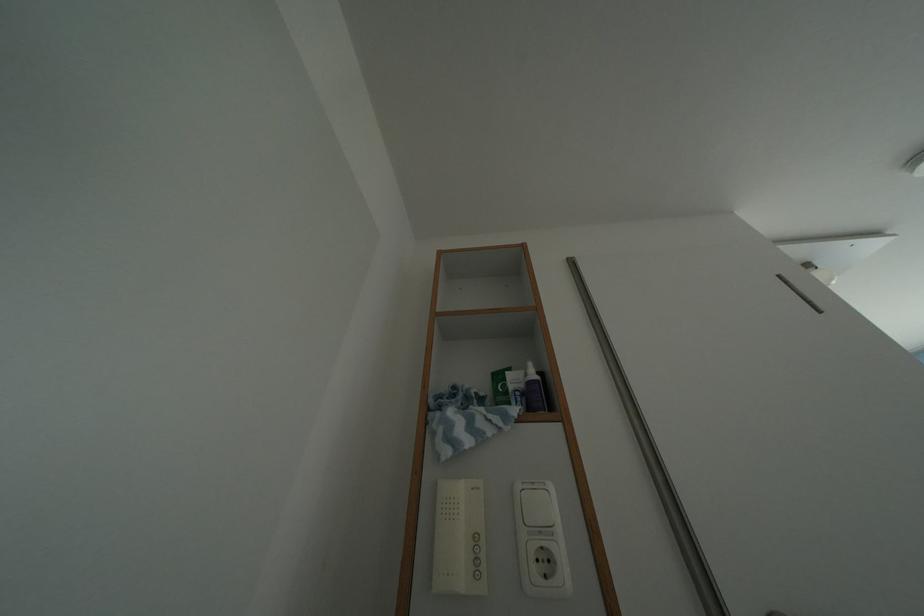
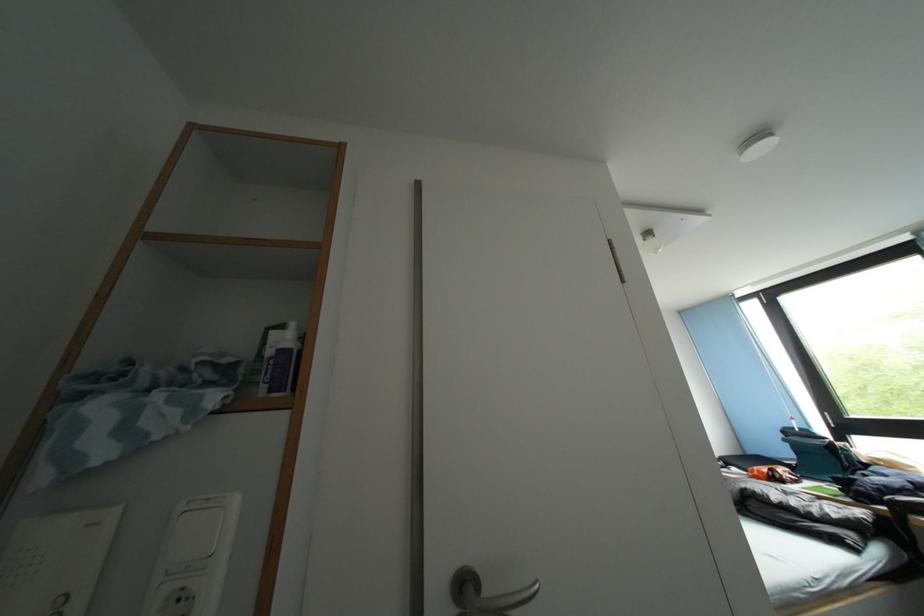
Which direction would the cameraman need to move to produce the second image?

The cameraman moved toward right, forward.